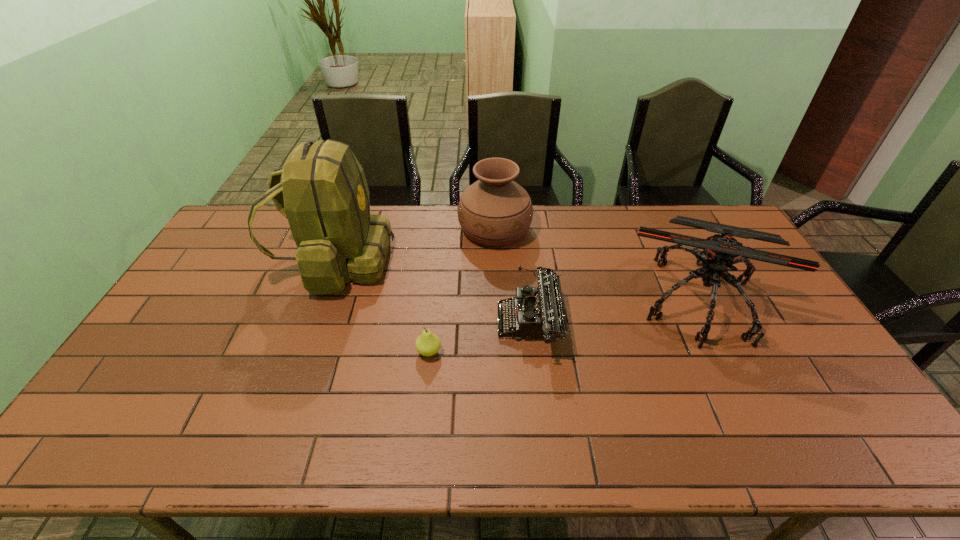
The height and width of the screenshot is (540, 960). Identify the location of vacant region at the near right corner of the desktop. (819, 442).

The height and width of the screenshot is (540, 960). Find the location of `unoccupied position between the urn and the second object from left to right`. unoccupied position between the urn and the second object from left to right is located at coordinates (462, 291).

Where is `free space between the typewriter and the rightmost object`? This screenshot has height=540, width=960. free space between the typewriter and the rightmost object is located at coordinates (615, 311).

Where is `empty space that is in between the second object from left to right and the backpack`? The height and width of the screenshot is (540, 960). empty space that is in between the second object from left to right and the backpack is located at coordinates (382, 306).

Locate an element on the screen. The width and height of the screenshot is (960, 540). vacant point located between the drone and the typewriter is located at coordinates (615, 311).

Locate an element on the screen. Image resolution: width=960 pixels, height=540 pixels. blank region between the urn and the tallest object is located at coordinates pos(415,245).

Identify the location of empty space between the leftmost object and the pear. (382, 306).

The height and width of the screenshot is (540, 960). What are the coordinates of `vacant region between the rightmost object and the urn` in the screenshot? It's located at [x=597, y=264].

You are a GUI agent. You are given a task and a screenshot of the screen. Output one action in this format:
    pyautogui.click(x=<x>, y=<y>)
    Task: Click on the unoccupied area between the pear and the typewriter
    
    Given the screenshot: What is the action you would take?
    pyautogui.click(x=480, y=338)

The image size is (960, 540). What are the coordinates of `free space between the urn and the drone` in the screenshot? It's located at (597, 264).